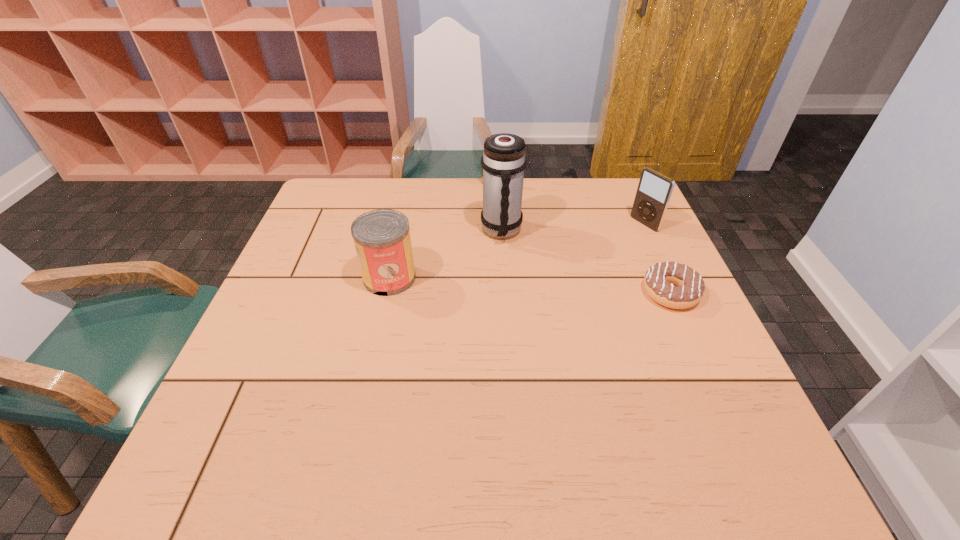
Find the location of a particular element. This screenshot has width=960, height=540. vacant region that satisfies the following two spatial constraints: 1. on the front side of the thermos bottle; 2. on the right side of the second shortest object is located at coordinates (495, 231).

Where is `free location that satisfies the following two spatial constraints: 1. on the front side of the thermos bottle; 2. on the left side of the doughnut`? The height and width of the screenshot is (540, 960). free location that satisfies the following two spatial constraints: 1. on the front side of the thermos bottle; 2. on the left side of the doughnut is located at coordinates (505, 293).